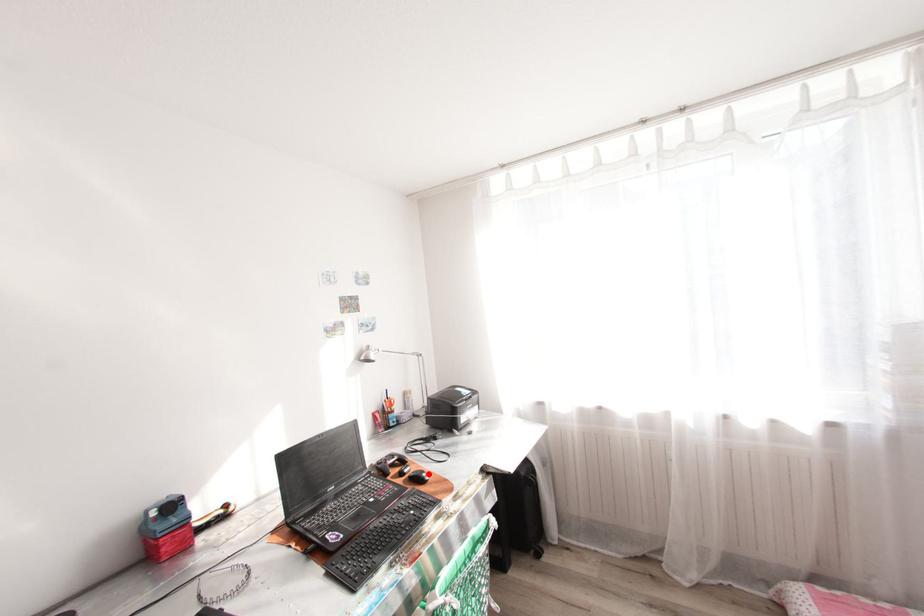
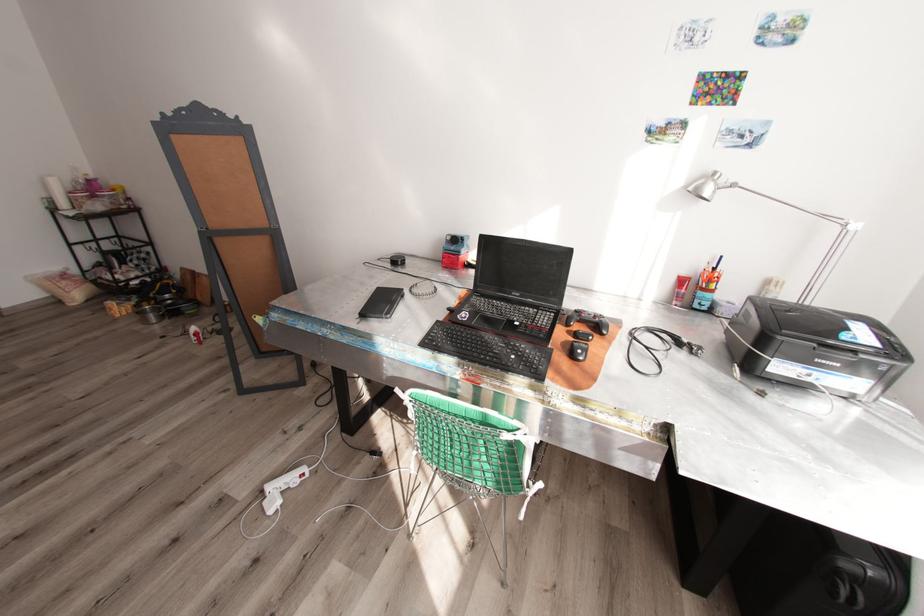
Where in the second image is the point corresponding to the highlighted location from the first image?

(584, 351)